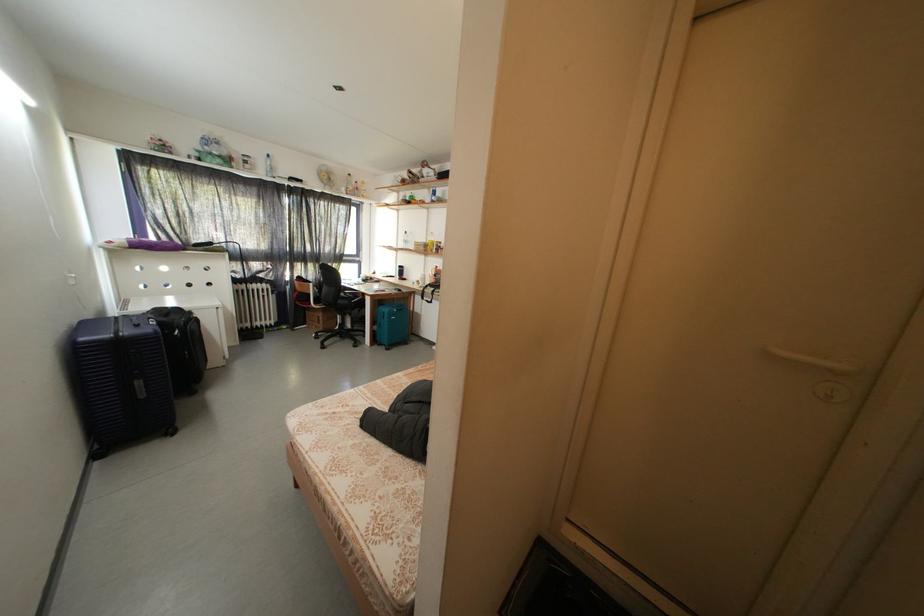
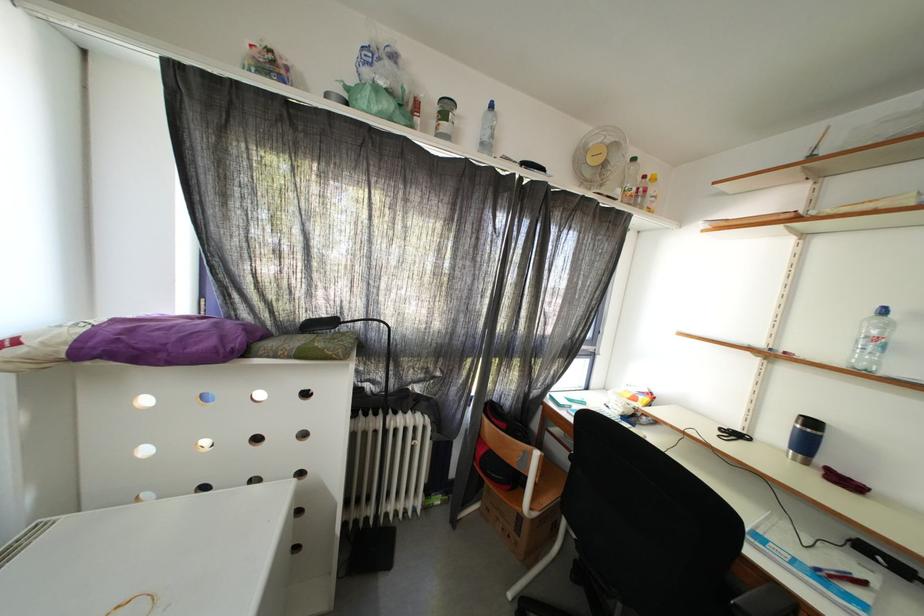
Locate, in the second image, the point that corresponds to (x=408, y=272) in the first image.

(820, 429)